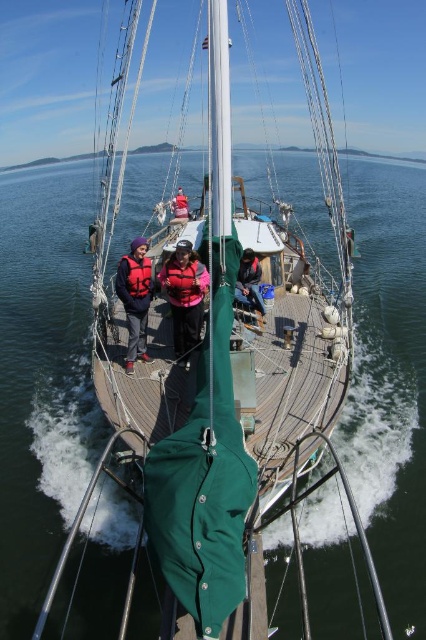
Question: Is pink life jacket at center above red life jacket at center?

Choices:
 (A) no
 (B) yes

Answer: (A)

Question: Among these objects, which one is nearest to the camera?

Choices:
 (A) matte black jacket at center
 (B) matte pink life vest at center
 (C) orange life jacket at center
 (D) matte pink life jacket at center

Answer: (B)

Question: Which point is closer to the camera?

Choices:
 (A) (161, 272)
 (B) (135, 298)
 (C) (141, 340)

Answer: (B)

Question: Which point is farther to the camera?

Choices:
 (A) matte black jacket at center
 (B) matte pink life vest at center
 (C) dark blue fabric jacket at center
 (D) orange life jacket at center

Answer: (C)

Question: Considering the relative positions of pink life jacket at center and dark blue fabric jacket at center in the image provided, where is pink life jacket at center located with respect to dark blue fabric jacket at center?

Choices:
 (A) left
 (B) right

Answer: (A)

Question: Is orange life jacket at center above red life jacket at center?

Choices:
 (A) no
 (B) yes

Answer: (A)